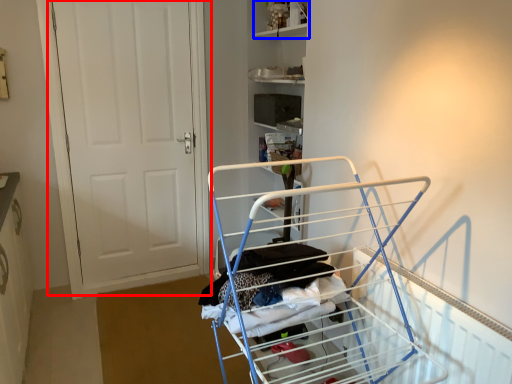
Question: Among these objects, which one is farthest to the camera, door (highlighted by a red box) or shelf (highlighted by a blue box)?

Choices:
 (A) door
 (B) shelf

Answer: (B)